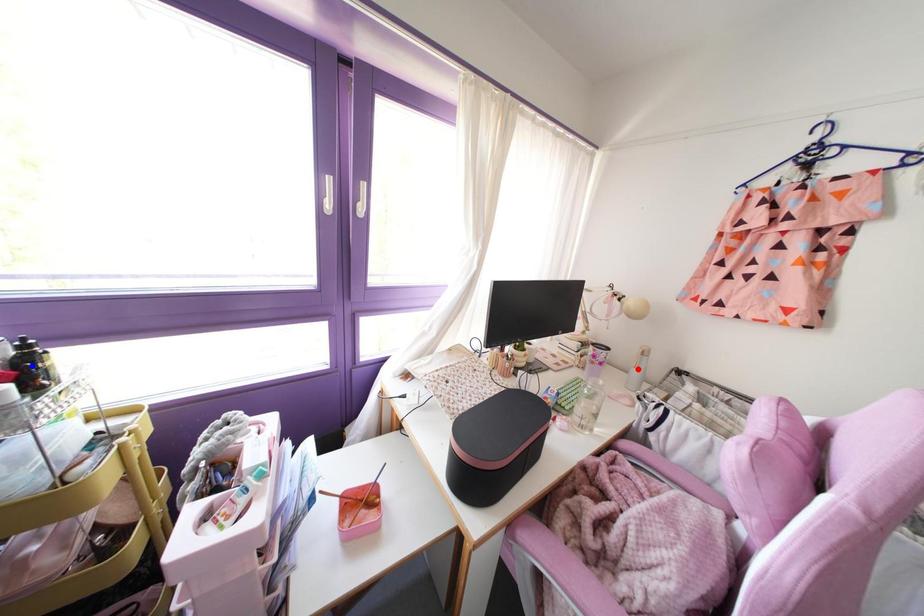
Question: Which of the two points in the image is closer to the camera?

Choices:
 (A) Blue point is closer.
 (B) Red point is closer.

Answer: (A)